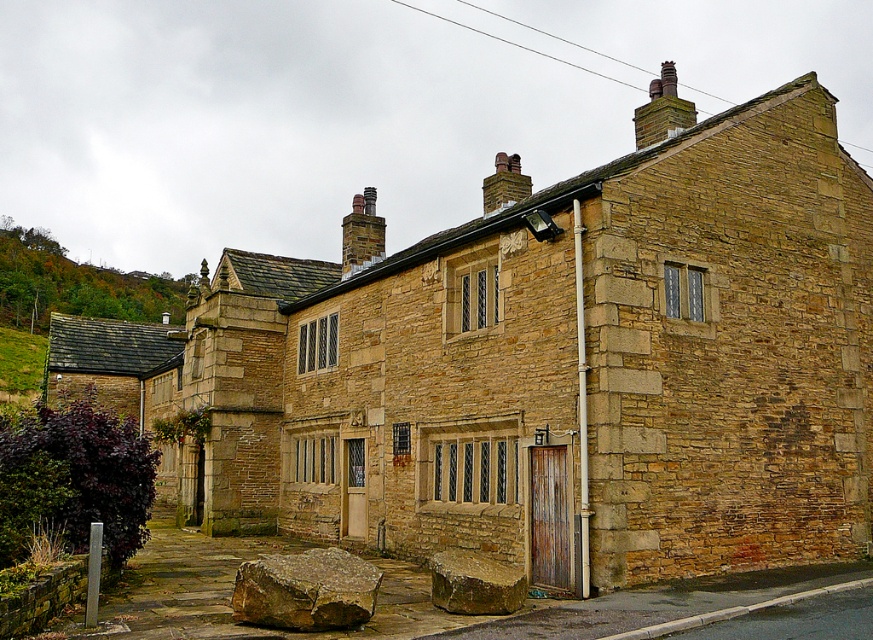
Question: Is rusty metal chimney at upper right positioned behind brown brick chimney at upper center?

Choices:
 (A) yes
 (B) no

Answer: (B)

Question: Is smooth brown rock at lower center further to camera compared to rusty metal chimney at upper right?

Choices:
 (A) no
 (B) yes

Answer: (A)

Question: Which object is the farthest from the brown brick chimney at upper center?

Choices:
 (A) green leafy hillside at upper left
 (B) brown rough rock at lower center
 (C) rusty metal chimney at upper right

Answer: (A)

Question: Which object is positioned farthest from the dark gray stone chimney at upper center?

Choices:
 (A) green leafy hillside at upper left
 (B) brown brick chimney at upper center

Answer: (A)

Question: Which point is farther to the camera?

Choices:
 (A) dark gray stone chimney at upper center
 (B) rusty metal chimney at upper right

Answer: (A)

Question: Can you confirm if dark gray stone chimney at upper center is positioned to the right of brown brick chimney at upper center?

Choices:
 (A) no
 (B) yes

Answer: (A)